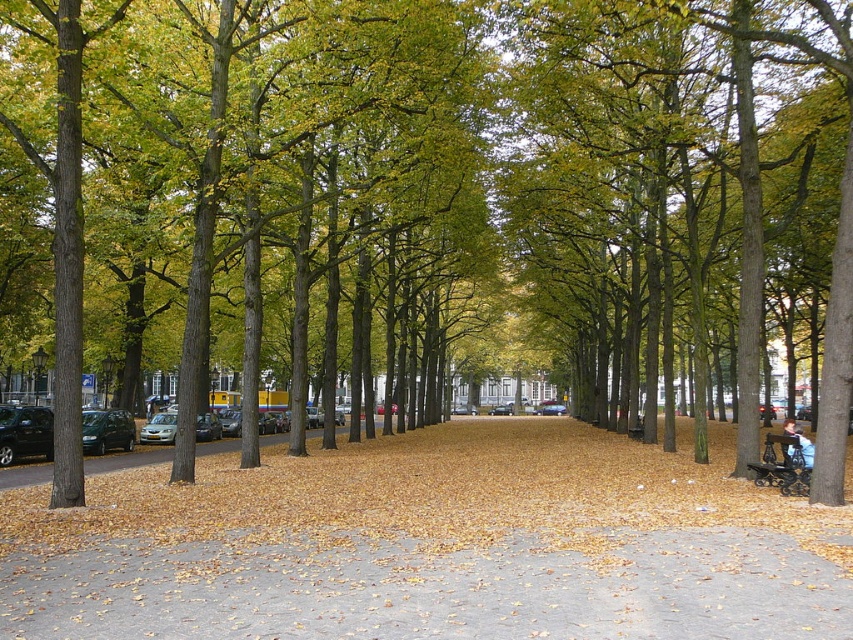
Can you confirm if wooden park bench at lower right is positioned above light brown leather jacket at lower right?

Yes.

Is wooden park bench at lower right wider than light brown leather jacket at lower right?

No.

At what (x,y) coordinates should I click in order to perform the action: click on wooden park bench at lower right. Please return your answer as a coordinate pair (x, y). This screenshot has width=853, height=640. Looking at the image, I should click on (784, 464).